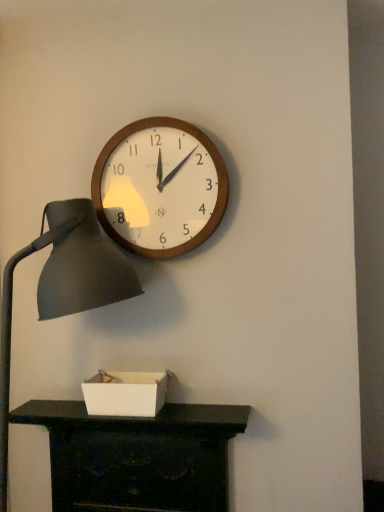
The image size is (384, 512). What do you see at coordinates (159, 187) in the screenshot? I see `wooden wall clock at upper center` at bounding box center [159, 187].

Measure the distance between matte black desk at lower center and camera.

1.35 meters.

This screenshot has height=512, width=384. I want to click on wooden wall clock at upper center, so click(x=159, y=187).

Which is in front, point (154, 372) or point (76, 444)?

The point (154, 372) is closer.

Could matte black desk at lower center be considered to be inside white cardboard box at lower center?

No, matte black desk at lower center is not inside white cardboard box at lower center.

Who is smaller, white cardboard box at lower center or matte black desk at lower center?

white cardboard box at lower center is smaller.

Looking at this image, is white cardboard box at lower center oriented away from matte black desk at lower center?

No, white cardboard box at lower center's orientation is not away from matte black desk at lower center.

In the scene shown: Is white cardboard box at lower center taller than wooden wall clock at upper center?

No.

How different are the orientations of white cardboard box at lower center and wooden wall clock at upper center in degrees?

They differ by 0.537 degrees in their facing directions.

Looking at the image, does white cardboard box at lower center seem bigger or smaller compared to wooden wall clock at upper center?

Considering their sizes, white cardboard box at lower center takes up less space than wooden wall clock at upper center.

Locate an element on the screen. The image size is (384, 512). wall clock above the white cardboard box at lower center (from a real-world perspective) is located at coordinates (159, 187).

How many degrees apart are the facing directions of wooden wall clock at upper center and white cardboard box at lower center?

0.537 degrees.

Considering the sizes of objects wooden wall clock at upper center and white cardboard box at lower center in the image provided, who is shorter, wooden wall clock at upper center or white cardboard box at lower center?

white cardboard box at lower center is shorter.

From the image's perspective, does wooden wall clock at upper center appear higher than white cardboard box at lower center?

Indeed, from the image's perspective, wooden wall clock at upper center is shown above white cardboard box at lower center.

Do you think wooden wall clock at upper center is within white cardboard box at lower center, or outside of it?

wooden wall clock at upper center is not inside white cardboard box at lower center, it's outside.

From the image's perspective, between matte black desk at lower center and matte black lamp at left, who is located below?

From the image's view, matte black desk at lower center is below.

From a real-world perspective, is matte black desk at lower center located beneath matte black lamp at left?

Yes, from a real-world perspective, matte black desk at lower center is below matte black lamp at left.

Between point (111, 473) and point (0, 387), which one is positioned in front?

The point (0, 387) is closer to the camera.

Considering the positions of objects wooden wall clock at upper center and matte black lamp at left in the image provided, who is in front, wooden wall clock at upper center or matte black lamp at left?

matte black lamp at left is in front.

Which is further, (x=113, y=225) or (x=1, y=355)?

The point (x=113, y=225) is farther.

Measure the distance from wooden wall clock at upper center to matte black lamp at left.

wooden wall clock at upper center is 10.76 inches away from matte black lamp at left.

Which object is wider, wooden wall clock at upper center or matte black lamp at left?

matte black lamp at left is wider.

Can you confirm if white cardboard box at lower center is smaller than matte black lamp at left?

Yes.

Is white cardboard box at lower center next to matte black lamp at left?

white cardboard box at lower center is not next to matte black lamp at left, and they're not touching.

From the image's perspective, which is above, white cardboard box at lower center or matte black lamp at left?

matte black lamp at left is shown above in the image.

Between wooden wall clock at upper center and matte black desk at lower center, which one has smaller width?

Thinner between the two is wooden wall clock at upper center.

Who is smaller, wooden wall clock at upper center or matte black desk at lower center?

A: wooden wall clock at upper center.

From the image's perspective, is wooden wall clock at upper center on matte black desk at lower center?

Yes, from the image's perspective, wooden wall clock at upper center is above matte black desk at lower center.

Can you confirm if wooden wall clock at upper center is taller than matte black desk at lower center?

In fact, wooden wall clock at upper center may be shorter than matte black desk at lower center.

I want to click on box above the matte black desk at lower center (from a real-world perspective), so click(125, 393).

The height and width of the screenshot is (512, 384). I want to click on box located in front of the wooden wall clock at upper center, so click(x=125, y=393).

Estimate the real-world distances between objects in this image. Which object is closer to matte black desk at lower center, matte black lamp at left or white cardboard box at lower center?

white cardboard box at lower center lies closer to matte black desk at lower center than the other object.

Estimate the real-world distances between objects in this image. Which object is further from matte black desk at lower center, white cardboard box at lower center or matte black lamp at left?

matte black lamp at left lies further to matte black desk at lower center than the other object.

When comparing their distances from matte black lamp at left, does white cardboard box at lower center or matte black desk at lower center seem further?

The object further to matte black lamp at left is matte black desk at lower center.

Estimate the real-world distances between objects in this image. Which object is further from matte black lamp at left, matte black desk at lower center or white cardboard box at lower center?

Based on the image, matte black desk at lower center appears to be further to matte black lamp at left.

When comparing their distances from matte black desk at lower center, does wooden wall clock at upper center or matte black lamp at left seem closer?

Among the two, matte black lamp at left is located nearer to matte black desk at lower center.

When comparing their distances from matte black lamp at left, does white cardboard box at lower center or wooden wall clock at upper center seem further?

The object further to matte black lamp at left is white cardboard box at lower center.

When comparing their distances from wooden wall clock at upper center, does matte black desk at lower center or white cardboard box at lower center seem closer?

white cardboard box at lower center is positioned closer to the anchor wooden wall clock at upper center.

When comparing their distances from white cardboard box at lower center, does wooden wall clock at upper center or matte black lamp at left seem closer?

The object closer to white cardboard box at lower center is matte black lamp at left.

You are a GUI agent. You are given a task and a screenshot of the screen. Output one action in this format:
    pyautogui.click(x=<x>, y=<y>)
    Task: Click on the box between matte black lamp at left and matte black desk at lower center from top to bottom
    
    Given the screenshot: What is the action you would take?
    pyautogui.click(x=125, y=393)

I want to click on lamp between wooden wall clock at upper center and matte black desk at lower center vertically, so click(x=63, y=286).

At what (x,y) coordinates should I click in order to perform the action: click on box between wooden wall clock at upper center and matte black desk at lower center from top to bottom. Please return your answer as a coordinate pair (x, y). The image size is (384, 512). Looking at the image, I should click on (125, 393).

I want to click on lamp between wooden wall clock at upper center and white cardboard box at lower center in the vertical direction, so click(x=63, y=286).